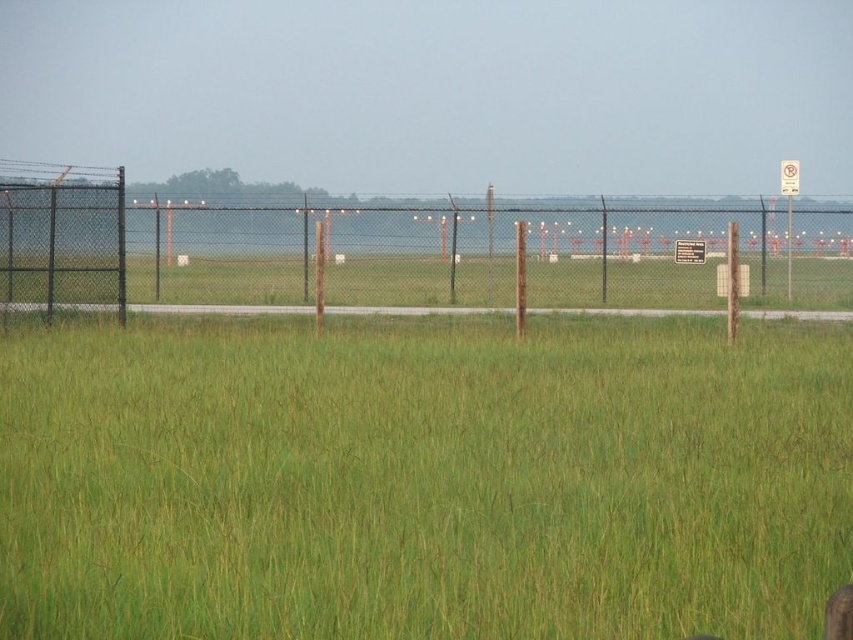
This screenshot has height=640, width=853. I want to click on green grassy field at center, so click(422, 481).

Who is more distant from viewer, (805, 586) or (4, 225)?

Positioned behind is point (4, 225).

This screenshot has height=640, width=853. What do you see at coordinates (422, 481) in the screenshot? I see `green grassy field at center` at bounding box center [422, 481].

Locate an element on the screen. Image resolution: width=853 pixels, height=640 pixels. green grassy field at center is located at coordinates (422, 481).